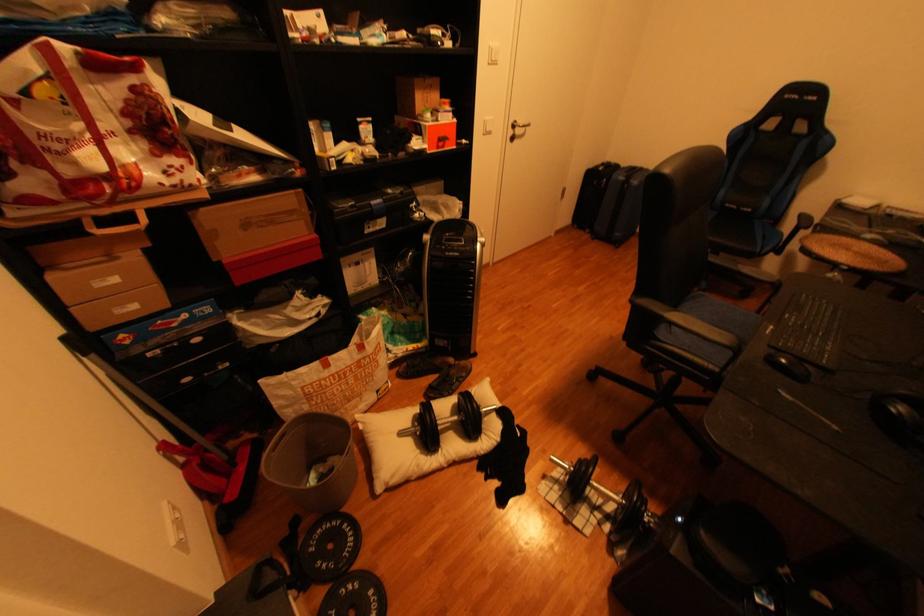
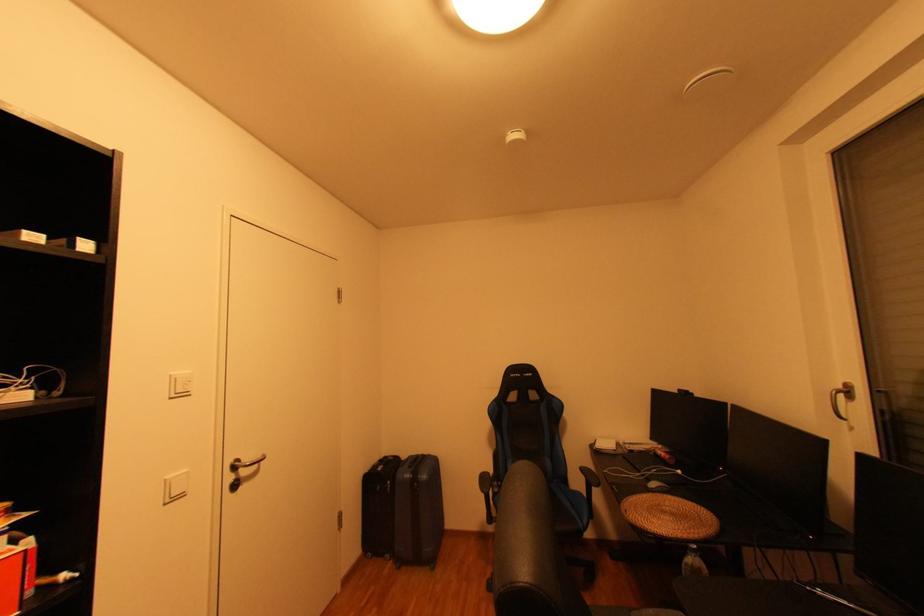
Where in the second image is the point corresponding to point (856, 249) from the first image?

(674, 513)